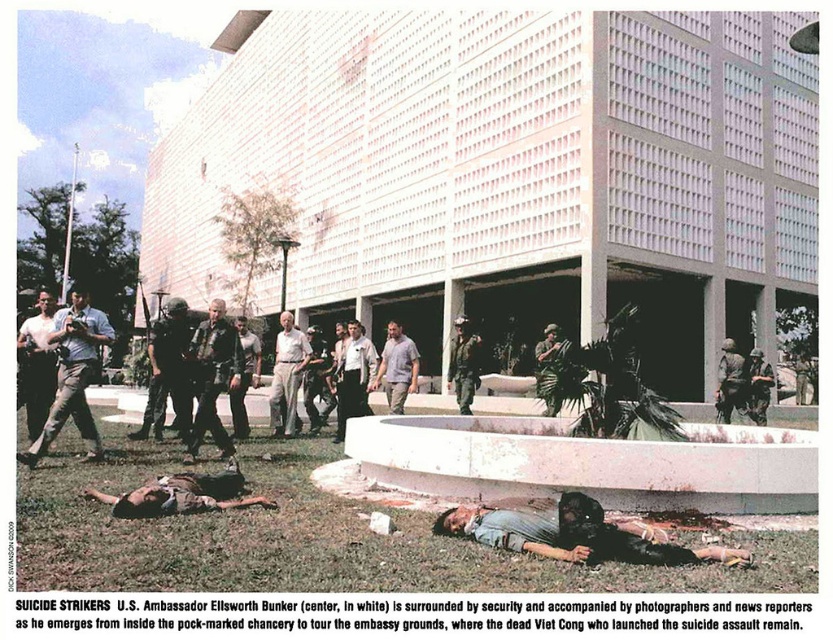
Can you confirm if blue fabric body at lower center is bigger than white cotton shirt at center?

No, blue fabric body at lower center is not bigger than white cotton shirt at center.

Who is lower down, blue fabric body at lower center or white cotton shirt at center?

Positioned lower is blue fabric body at lower center.

Does point (572, 506) lie in front of point (283, 317)?

Yes, point (572, 506) is closer to viewer.

At what (x,y) coordinates should I click in order to perform the action: click on blue fabric body at lower center. Please return your answer as a coordinate pair (x, y). Image resolution: width=833 pixels, height=640 pixels. Looking at the image, I should click on (572, 534).

Consider the image. Which of these two, camouflage uniform at center or dark gray uniform at center, stands taller?

With more height is camouflage uniform at center.

Which is behind, point (460, 365) or point (250, 339)?

The point (460, 365) is behind.

What do you see at coordinates (464, 364) in the screenshot?
I see `camouflage uniform at center` at bounding box center [464, 364].

I want to click on camouflage uniform at center, so click(x=464, y=364).

Does green grass at lower center have a greater height compared to light brown leather jacket at left?

In fact, green grass at lower center may be shorter than light brown leather jacket at left.

Looking at this image, can you confirm if green grass at lower center is shorter than light brown leather jacket at left?

Indeed, green grass at lower center has a lesser height compared to light brown leather jacket at left.

Locate an element on the screen. green grass at lower center is located at coordinates (310, 538).

Find the location of a particular element. green grass at lower center is located at coordinates (310, 538).